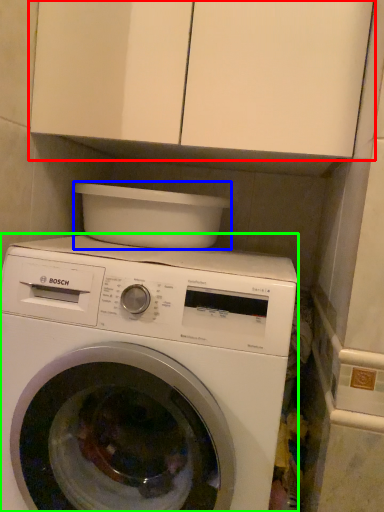
Question: Based on their relative distances, which object is farther from cabinetry (highlighted by a red box)? Choose from appliance (highlighted by a blue box) and washing machine (highlighted by a green box).

Choices:
 (A) appliance
 (B) washing machine

Answer: (B)